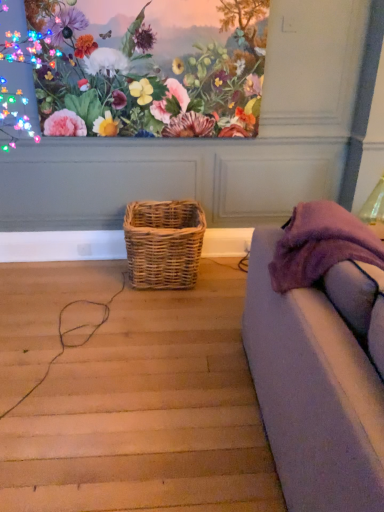
The image size is (384, 512). What are the coordinates of `free space that is to the left of woven natural basket at center` in the screenshot? It's located at (84, 284).